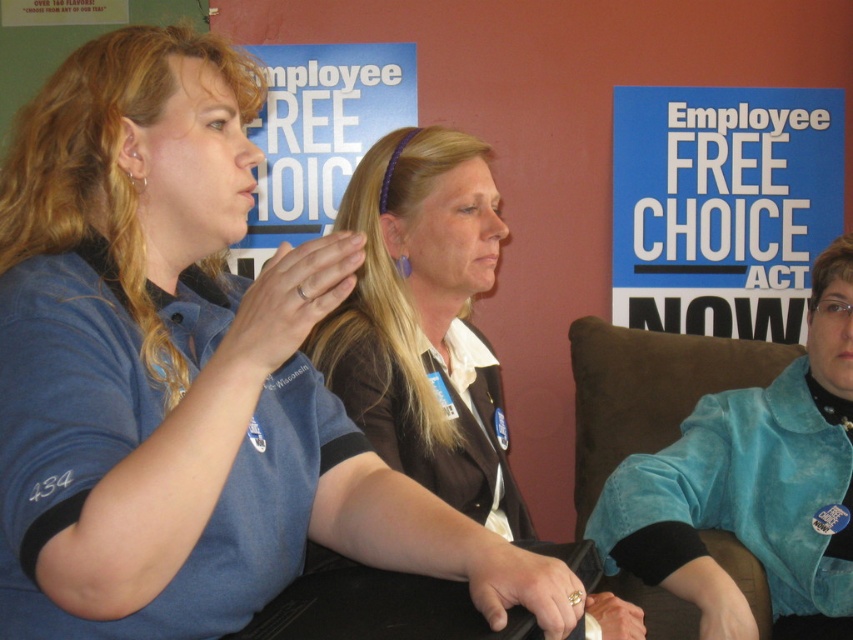
Is brown suede chair at right to the left of blue fabric poster at center from the viewer's perspective?

No, brown suede chair at right is not to the left of blue fabric poster at center.

Measure the distance between point (788, 346) and camera.

They are 7.77 feet apart.

Where is `brown suede chair at right`? Image resolution: width=853 pixels, height=640 pixels. brown suede chair at right is located at coordinates (648, 392).

Can you confirm if blue fabric shirt at left is taller than blue paper sign at upper center?

In fact, blue fabric shirt at left may be shorter than blue paper sign at upper center.

Between blue fabric shirt at left and blue paper sign at upper center, which one has less height?

With less height is blue fabric shirt at left.

Find the location of a particular element. The height and width of the screenshot is (640, 853). blue fabric shirt at left is located at coordinates (184, 374).

Can you confirm if blue fabric shirt at left is positioned below blue fabric poster at center?

Yes, blue fabric shirt at left is below blue fabric poster at center.

Who is higher up, blue fabric shirt at left or blue fabric poster at center?

blue fabric poster at center

Measure the distance between blue fabric shirt at left and camera.

A distance of 30.35 inches exists between blue fabric shirt at left and camera.

Find the location of `blue fabric shirt at left`. blue fabric shirt at left is located at coordinates (184, 374).